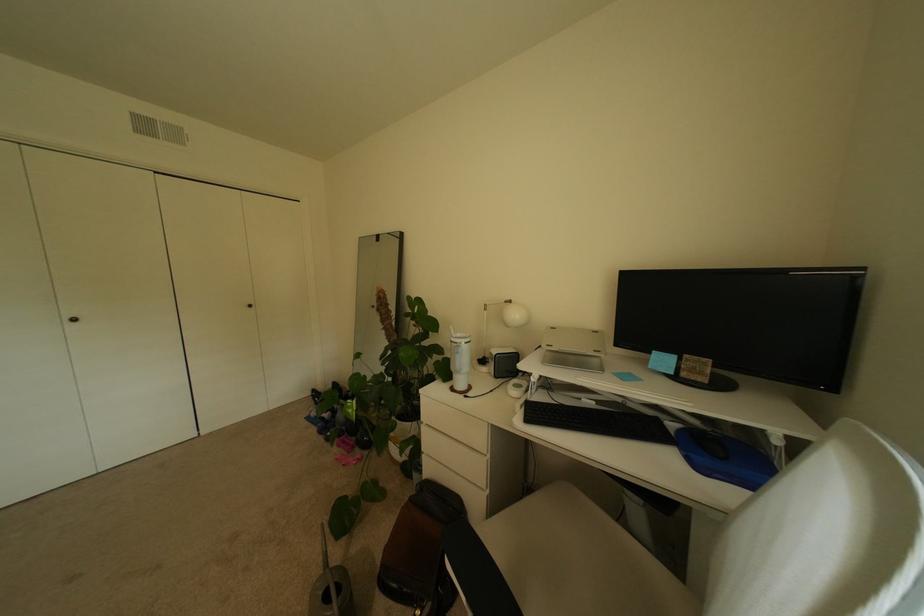
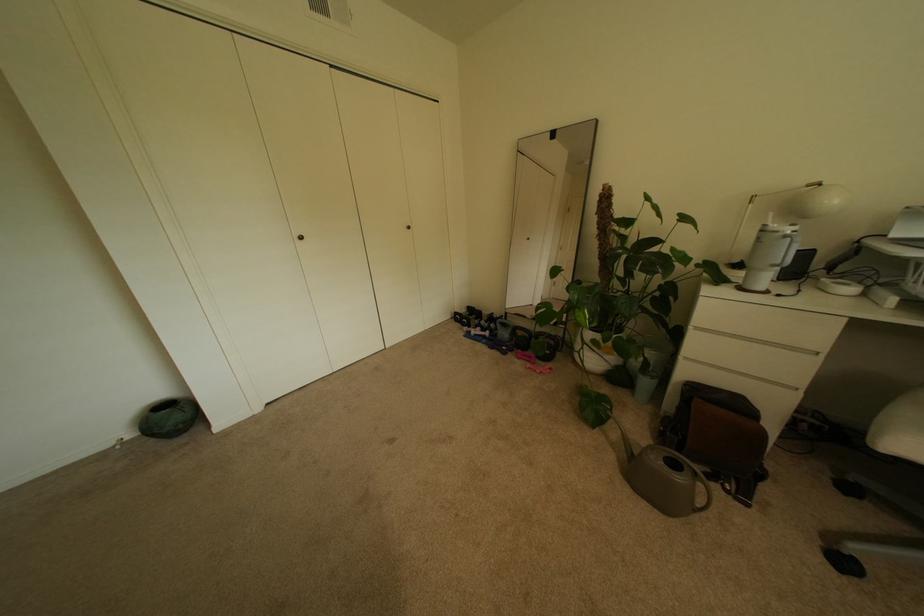
In the second image, find the point that corresponds to (x=355, y=435) in the first image.

(524, 350)